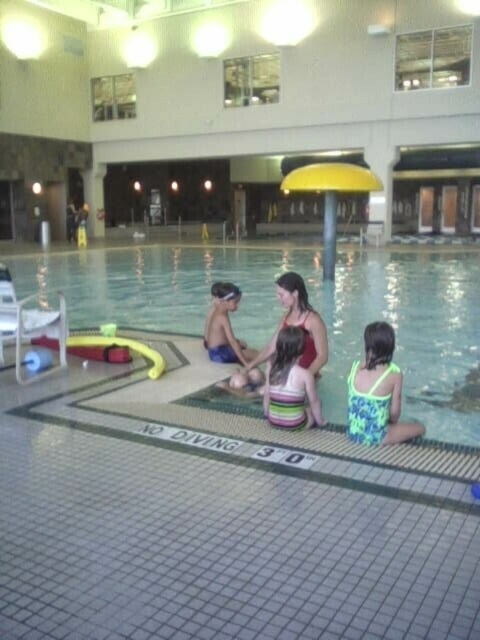
In the scene shown: You are standing at the edge of the pool and want to hand a towel to the person wearing the striped fabric swimsuit at center and the person wearing the matte red swimsuit at center. Which one can you reach without moving from your current position?

The striped fabric swimsuit at center is in front of the matte red swimsuit at center, so you can reach the striped fabric swimsuit at center without moving, but you might need to move to reach the matte red swimsuit at center.

You are standing at the edge of the pool and see two people wearing swimsuits. The first is wearing a striped fabric swimsuit at center and the second is wearing a matte red swimsuit at center. Which swimsuit is positioned to the left?

The striped fabric swimsuit at center is positioned to the left of the matte red swimsuit at center.

Looking at this image, you are designing a new seating arrangement for the pool edge where the striped fabric swimsuit at center and matte red swimsuit at center are currently sitting. If you want to ensure both individuals have equal space, which swimsuit should you adjust to match the other in width?

The striped fabric swimsuit at center has a smaller width than the matte red swimsuit at center. To ensure equal space, you should widen the striped fabric swimsuit at center to match the width of the matte red swimsuit at center.